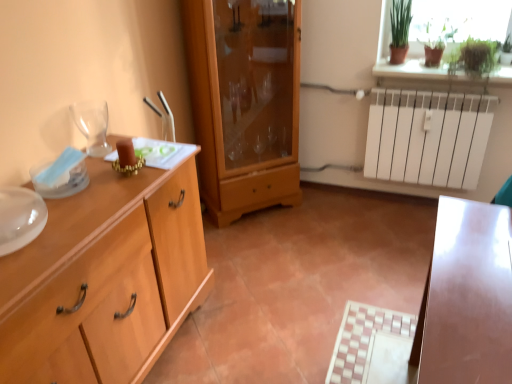
Where is `free point above light wood chest of drawers at left (from a real-world perspective)`? Image resolution: width=512 pixels, height=384 pixels. free point above light wood chest of drawers at left (from a real-world perspective) is located at coordinates (84, 193).